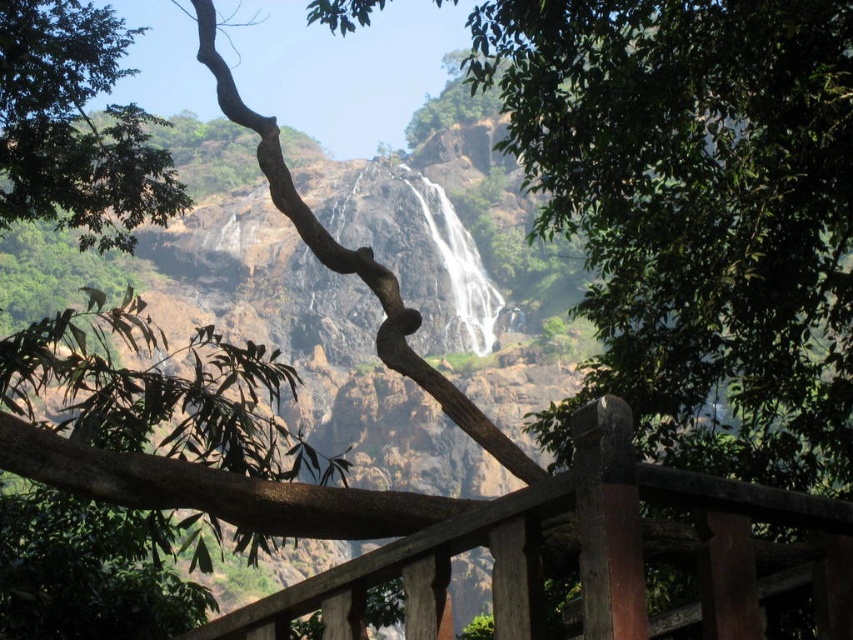
Looking at this image, you are a painter standing at the edge of the cliff, wanting to capture the brown wooden fence at center and the green leafy tree at upper left in your painting. Which object should you focus on first if you want to paint the wider one?

The green leafy tree at upper left is wider than the brown wooden fence at center, so you should focus on painting the green leafy tree at upper left first.

You are standing at the edge of the cliff and want to reach the brown wooden fence at center. Based on the scene, in which direction should you move relative to the waterfall?

The brown wooden fence at center is located at point 0.863 on the x and 0.680 on the y axis. Since the waterfall is centrally positioned, moving towards the right side of the waterfall would lead you to the brown wooden fence at center.